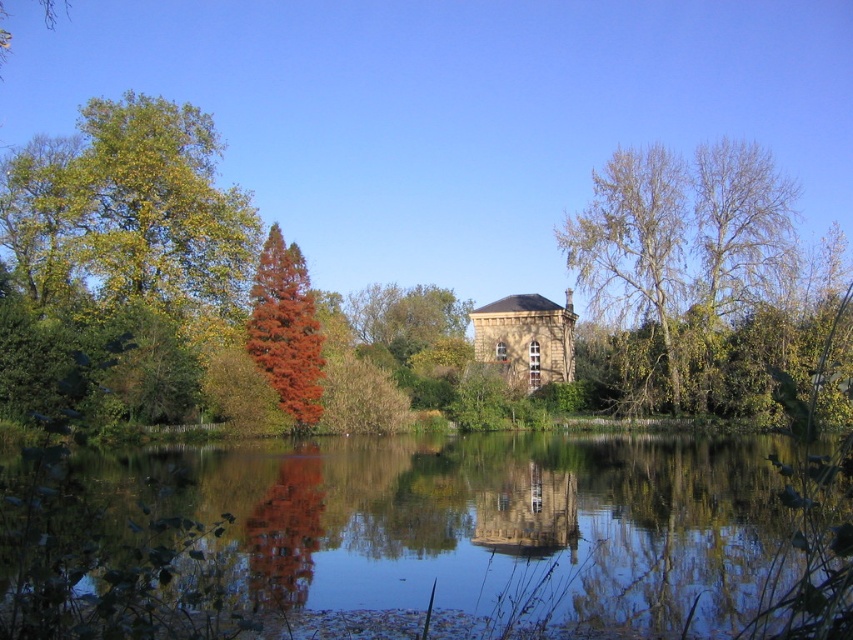
Question: Which point is farther to the camera?

Choices:
 (A) [315, 531]
 (B) [618, 170]
 (C) [305, 422]
 (D) [479, 506]

Answer: (B)

Question: Estimate the real-world distances between objects in this image. Which object is farther from the smooth stone tower at center?

Choices:
 (A) transparent water at center
 (B) bare wood tree at center
 (C) smooth red tree at center

Answer: (B)

Question: Among these points, which one is farthest from the camera?

Choices:
 (A) (318, 368)
 (B) (567, 250)
 (C) (334, 536)

Answer: (B)

Question: Can you confirm if bare wood tree at center is positioned below smooth stone tower at center?

Choices:
 (A) no
 (B) yes

Answer: (A)

Question: Is the position of transparent water at center less distant than that of bare wood tree at center?

Choices:
 (A) no
 (B) yes

Answer: (B)

Question: Is smooth red tree at center below smooth stone tower at center?

Choices:
 (A) no
 (B) yes

Answer: (A)